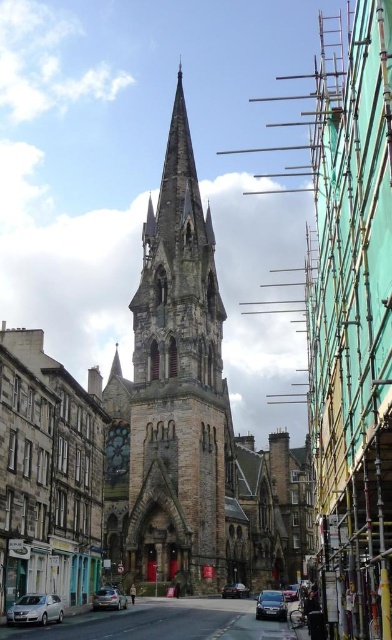
You are standing in front of the historic church and notice two points marked on the image. The first point is at coordinates point (41, 621), and the second is at point (234, 596). Which of these points is nearer to your current position?

Point (41, 621) is closer to the camera than point (234, 596), so the first point is nearer to your current position.

You are a delivery driver who needs to park your truck, which is 1.8 meters tall, in the parking lot near the church. There is a satin silver sedan at lower left and a shiny black sedan at center. Can your truck fit between them without hitting the roof?

The satin silver sedan at lower left has a lesser height compared to shiny black sedan at center. Since the shiny black sedan at center is taller, the minimum height clearance between them would be determined by the taller vehicle. Your truck is 1.8 meters tall, and if the shiny black sedan at center is taller than 1.8 meters, then the truck might not fit. However, without knowing the exact height of the shiny black sedan at center, it is impossible to determine if the truck can fit safely.

You are a parking attendant and need to park both the satin silver sedan at lower left and the metallic silver car at center in a parking spot that is 2 meters wide. Which car can fit into the spot without needing to adjust its position?

The satin silver sedan at lower left has a smaller width than the metallic silver car at center. Since the parking spot is 2 meters wide, the satin silver sedan at lower left can fit without needing to adjust its position, but the metallic silver car at center may be too wide.